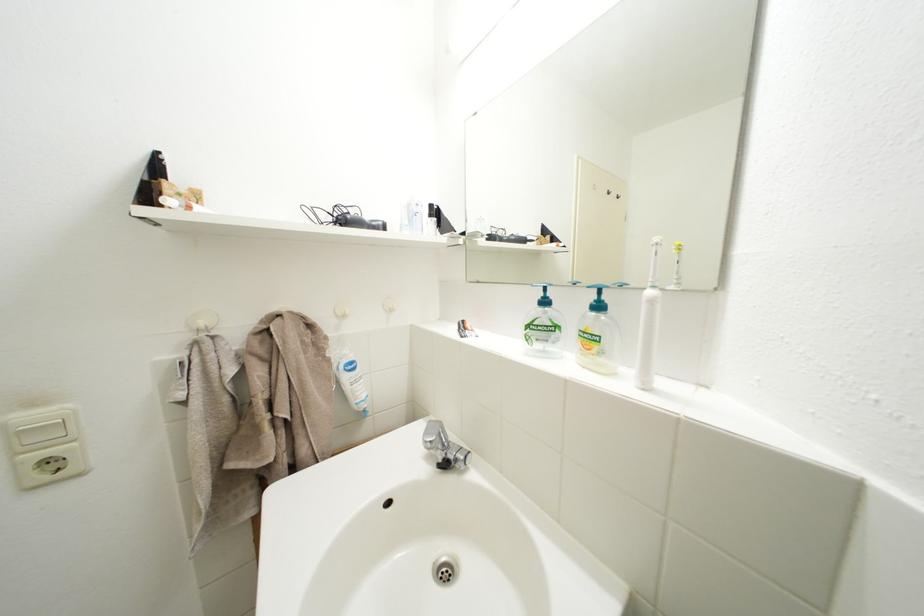
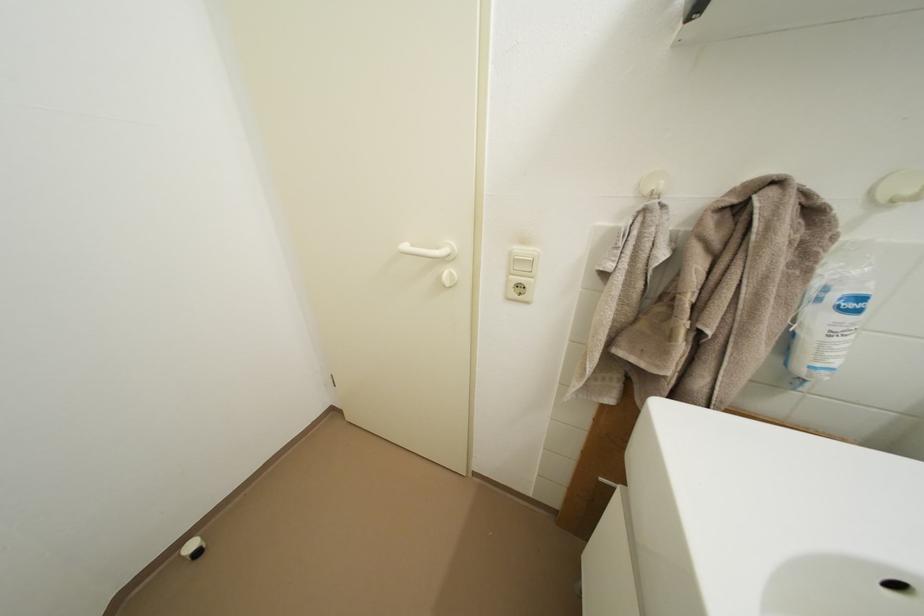
First-person continuous shooting, in which direction is the camera rotating?

The rotation direction of the camera is left-down.